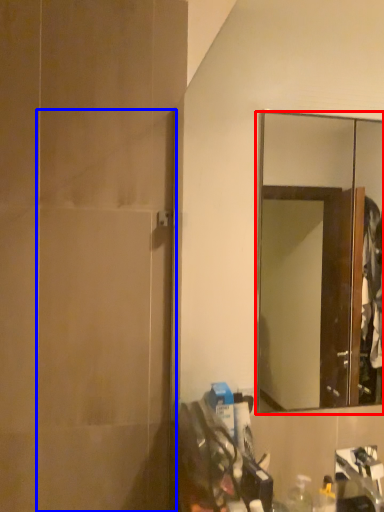
Question: Which point is closer to the camera, mirror (highlighted by a red box) or screen door (highlighted by a blue box)?

Choices:
 (A) mirror
 (B) screen door

Answer: (B)